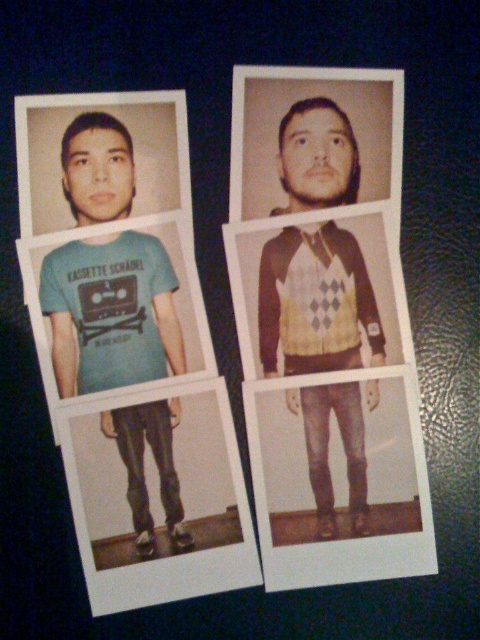
Question: Which point is farther to the camera?

Choices:
 (A) matte blue t-shirt at lower left
 (B) matte brown hair at center

Answer: (B)

Question: Can you confirm if matte blue t-shirt at lower left is bigger than matte brown hair at center?

Choices:
 (A) yes
 (B) no

Answer: (A)

Question: Does matte blue t-shirt at lower left have a smaller size compared to matte brown hair at center?

Choices:
 (A) no
 (B) yes

Answer: (A)

Question: Does matte blue t-shirt at lower left lie behind matte brown hair at center?

Choices:
 (A) no
 (B) yes

Answer: (A)

Question: Which point is farther to the camera?

Choices:
 (A) matte blue t-shirt at lower left
 (B) matte brown hair at center

Answer: (B)